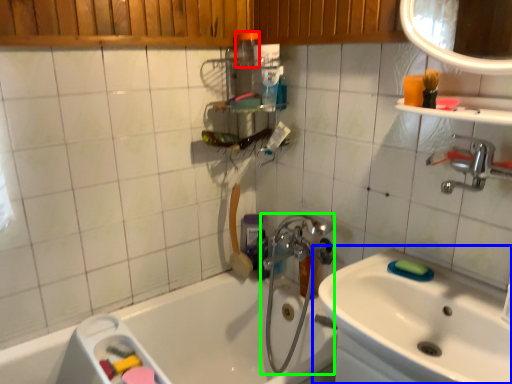
Question: Which object is the closest to the toiletry (highlighted by a red box)? Choose among these: sink (highlighted by a blue box) or plumbing fixture (highlighted by a green box).

Choices:
 (A) sink
 (B) plumbing fixture

Answer: (B)